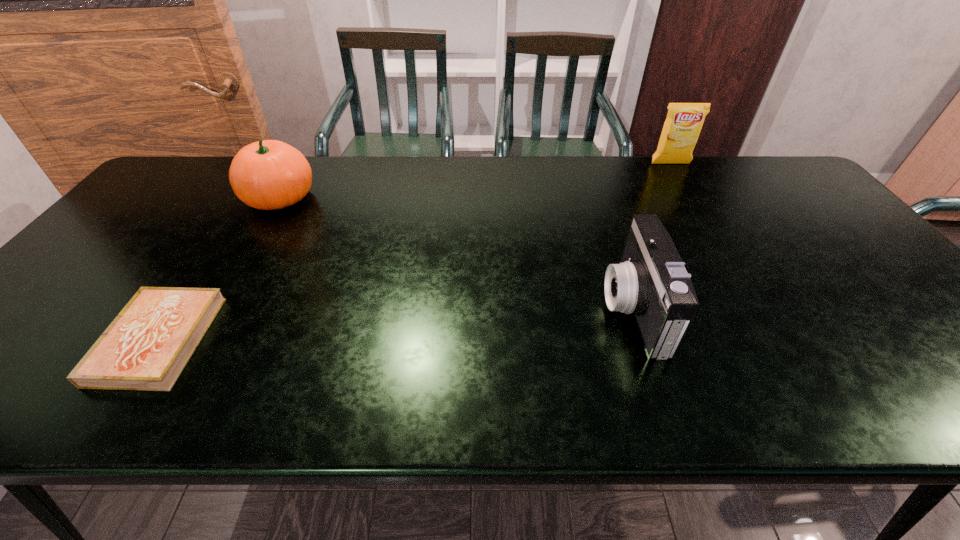
Find the location of `blank space located on the right of the hardback book`. blank space located on the right of the hardback book is located at coordinates (383, 340).

Find the location of a particular element. The height and width of the screenshot is (540, 960). crisp (potato chip) that is at the far edge is located at coordinates (684, 121).

Where is `pumpkin situated at the far edge`? The height and width of the screenshot is (540, 960). pumpkin situated at the far edge is located at coordinates (269, 174).

The height and width of the screenshot is (540, 960). Find the location of `object situated at the near edge`. object situated at the near edge is located at coordinates (146, 347).

Find the location of a particular element. The height and width of the screenshot is (540, 960). vacant area at the far edge of the desktop is located at coordinates (555, 158).

At what (x,y) coordinates should I click in order to perform the action: click on vacant space at the near edge of the desktop. Please return your answer as a coordinate pair (x, y). The image size is (960, 540). Looking at the image, I should click on (679, 411).

The width and height of the screenshot is (960, 540). In the image, there is a desktop. Find the location of `vacant region at the right edge`. vacant region at the right edge is located at coordinates (798, 201).

The image size is (960, 540). I want to click on vacant space at the far right corner of the desktop, so click(x=774, y=177).

Image resolution: width=960 pixels, height=540 pixels. In order to click on vacant space that's between the shortest object and the farthest object in this screenshot , I will do pos(415,252).

At what (x,y) coordinates should I click in order to perform the action: click on free space between the hardback book and the third object from left to right. Please return your answer as a coordinate pair (x, y). Looking at the image, I should click on (396, 325).